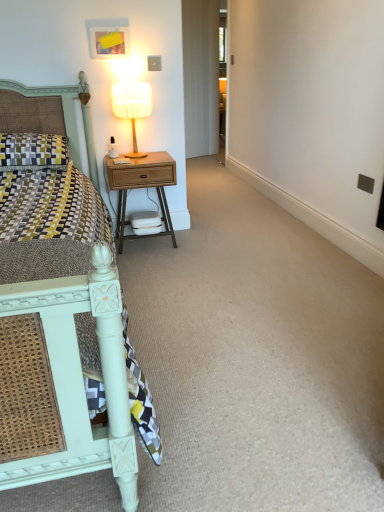
At what (x,y) coordinates should I click in order to perform the action: click on free point above woodenmaterial/texturenightstand at left (from a real-world perspective). Please return your answer as a coordinate pair (x, y). This screenshot has height=512, width=384. Looking at the image, I should click on (140, 155).